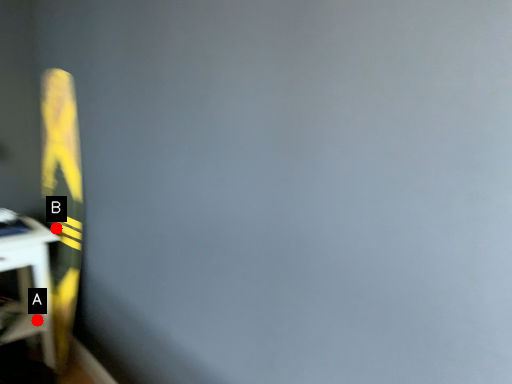
Question: Two points are circled on the image, labeled by A and B beside each circle. Which point appears closest to the camera in this image?

Choices:
 (A) A is closer
 (B) B is closer

Answer: (A)